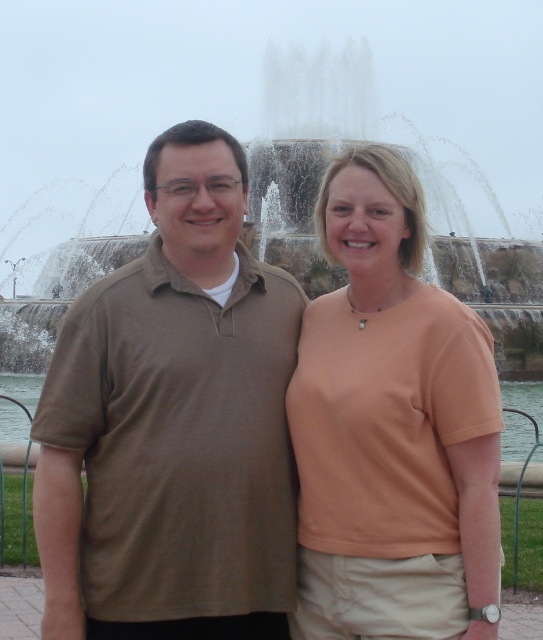
Is matte peach shirt at center taller than stone water at center?

In fact, matte peach shirt at center may be shorter than stone water at center.

Who is more forward, (x=344, y=230) or (x=24, y=269)?

Point (x=344, y=230) is in front.

Does point (419, 611) come behind point (470, 237)?

No, (419, 611) is in front of (470, 237).

At what (x,y) coordinates should I click in order to perform the action: click on matte peach shirt at center. Please return your answer as a coordinate pair (x, y). Looking at the image, I should click on (392, 428).

Does brown cotton shirt at center appear on the right side of stone water at center?

No, brown cotton shirt at center is not to the right of stone water at center.

Does brown cotton shirt at center come behind stone water at center?

No.

Is point (41, 486) closer to camera compared to point (307, 173)?

Yes, it is in front of point (307, 173).

Identify the location of brown cotton shirt at center. Image resolution: width=543 pixels, height=640 pixels. (173, 422).

Who is positioned more to the left, brown cotton shirt at center or matte peach shirt at center?

Positioned to the left is brown cotton shirt at center.

Can you confirm if brown cotton shirt at center is positioned to the left of matte peach shirt at center?

Yes, brown cotton shirt at center is to the left of matte peach shirt at center.

Is point (41, 456) positioned before point (389, 426)?

No, (41, 456) is further to viewer.

This screenshot has width=543, height=640. I want to click on brown cotton shirt at center, so click(x=173, y=422).